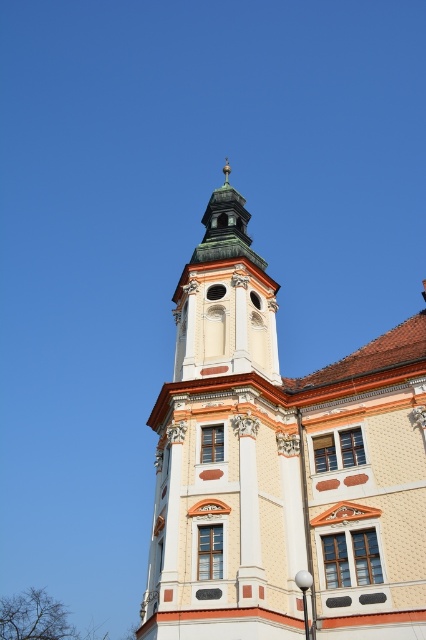
Question: Is white stone tower at center to the left of green copper bell tower at upper center from the viewer's perspective?

Choices:
 (A) no
 (B) yes

Answer: (A)

Question: Which point is farther to the camera?

Choices:
 (A) green copper bell tower at upper center
 (B) white stone tower at center

Answer: (A)

Question: Does white stone tower at center have a smaller size compared to green copper bell tower at upper center?

Choices:
 (A) no
 (B) yes

Answer: (A)

Question: Does white stone tower at center have a smaller size compared to green copper bell tower at upper center?

Choices:
 (A) yes
 (B) no

Answer: (B)

Question: Among these objects, which one is nearest to the camera?

Choices:
 (A) white stone tower at center
 (B) green copper bell tower at upper center

Answer: (A)